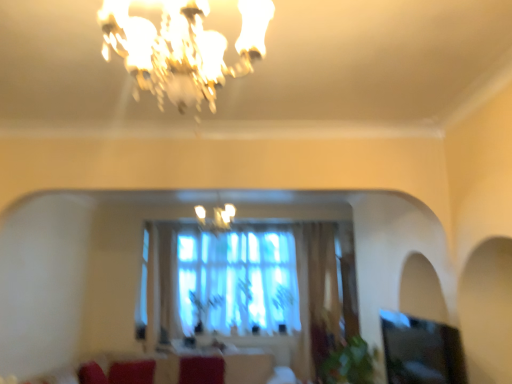
Find the location of a particular element. The image size is (512, 384). gold crystal chandelier at upper center, which ranks as the first lamp in front-to-back order is located at coordinates (182, 48).

Find the location of `wooden round table at center`. wooden round table at center is located at coordinates (211, 347).

Locate an element on the screen. This screenshot has height=384, width=512. velvet red couch at lower center is located at coordinates (178, 370).

Measure the distance between point (182, 359) and camera.

Point (182, 359) is 5.80 meters away from camera.

This screenshot has width=512, height=384. In order to click on gold crystal chandelier at upper center, which is the 1th lamp from top to bottom in this screenshot , I will do `click(182, 48)`.

Is transparent glass window screen at lower right touching gold crystal chandelier at upper center, which ranks as the first lamp in front-to-back order?

transparent glass window screen at lower right and gold crystal chandelier at upper center, which ranks as the first lamp in front-to-back order, are clearly separated.

Is transparent glass window screen at lower right in front of or behind gold crystal chandelier at upper center, which appears as the second lamp when ordered from the bottom, in the image?

Clearly, transparent glass window screen at lower right is behind gold crystal chandelier at upper center, which appears as the second lamp when ordered from the bottom.

Is transparent glass window screen at lower right facing towards gold crystal chandelier at upper center, marked as the second lamp in a back-to-front arrangement?

No.

Measure the distance from transparent glass window screen at lower right to gold crystal chandelier at upper center, marked as the second lamp in a back-to-front arrangement.

A distance of 5.65 feet exists between transparent glass window screen at lower right and gold crystal chandelier at upper center, marked as the second lamp in a back-to-front arrangement.

In the scene shown: From their relative heights in the image, would you say gold crystal chandelier at upper center, which is the 1th lamp from top to bottom, is taller or shorter than velvet red couch at lower center?

gold crystal chandelier at upper center, which is the 1th lamp from top to bottom, is taller than velvet red couch at lower center.

Is the surface of gold crystal chandelier at upper center, marked as the second lamp in a back-to-front arrangement, in direct contact with velvet red couch at lower center?

No, gold crystal chandelier at upper center, marked as the second lamp in a back-to-front arrangement, is not making contact with velvet red couch at lower center.

Does point (174, 25) lie behind point (137, 369)?

No, (174, 25) is closer to viewer.

Considering the points (194, 207) and (228, 348), which point is behind, point (194, 207) or point (228, 348)?

The point (228, 348) is more distant.

Where is `round table below the matte glass chandelier at center, the 1th lamp in the bottom-to-top sequence (from the image's perspective)`? The image size is (512, 384). round table below the matte glass chandelier at center, the 1th lamp in the bottom-to-top sequence (from the image's perspective) is located at coordinates (211, 347).

How far apart are matte glass chandelier at center, arranged as the second lamp when viewed from the top, and wooden round table at center?

matte glass chandelier at center, arranged as the second lamp when viewed from the top, is 2.23 meters from wooden round table at center.

What's the angular difference between matte glass chandelier at center, positioned as the first lamp in back-to-front order, and wooden round table at center's facing directions?

The facing directions of matte glass chandelier at center, positioned as the first lamp in back-to-front order, and wooden round table at center are 0.899 degrees apart.

Is wooden round table at center touching velvet red couch at lower center?

No, wooden round table at center is not touching velvet red couch at lower center.

Is wooden round table at center positioned with its back to velvet red couch at lower center?

No.

Which of these two, wooden round table at center or velvet red couch at lower center, is smaller?

wooden round table at center.

Which object is further away from the camera, wooden round table at center or velvet red couch at lower center?

wooden round table at center.

From the image's perspective, is transparent glass window screen at lower right located above velvet red couch at lower center?

Yes.

Would you say transparent glass window screen at lower right is a long distance from velvet red couch at lower center?

Yes, transparent glass window screen at lower right is far from velvet red couch at lower center.

Would you say transparent glass window screen at lower right contains velvet red couch at lower center?

No, velvet red couch at lower center is not inside transparent glass window screen at lower right.

Is transparent glass window screen at lower right bigger than velvet red couch at lower center?

No.

Consider the image. Is velvet maroon swivel chair at center surrounding matte glass chandelier at center, which appears as the 2th lamp when viewed from the front?

No, matte glass chandelier at center, which appears as the 2th lamp when viewed from the front, is not inside velvet maroon swivel chair at center.

Considering the sizes of velvet maroon swivel chair at center and matte glass chandelier at center, which appears as the 2th lamp when viewed from the front, in the image, is velvet maroon swivel chair at center bigger or smaller than matte glass chandelier at center, which appears as the 2th lamp when viewed from the front,?

In the image, velvet maroon swivel chair at center appears to be smaller than matte glass chandelier at center, which appears as the 2th lamp when viewed from the front.

At what (x,y) coordinates should I click in order to perform the action: click on lamp that is the 1st object to the right of the velvet maroon swivel chair at center, starting at the anchor. Please return your answer as a coordinate pair (x, y). Image resolution: width=512 pixels, height=384 pixels. Looking at the image, I should click on (216, 218).

Looking at the image, does velvet maroon swivel chair at center seem bigger or smaller compared to velvet red couch at lower center?

Considering their sizes, velvet maroon swivel chair at center takes up less space than velvet red couch at lower center.

Can velvet red couch at lower center be found inside velvet maroon swivel chair at center?

No, velvet red couch at lower center is not a part of velvet maroon swivel chair at center.

Considering the relative sizes of velvet maroon swivel chair at center and velvet red couch at lower center in the image provided, is velvet maroon swivel chair at center taller than velvet red couch at lower center?

Incorrect, the height of velvet maroon swivel chair at center is not larger of that of velvet red couch at lower center.

From the image's perspective, starting from the transparent glass window screen at lower right, which lamp is the 2nd one above? Please provide its 2D coordinates.

[(182, 48)]

The height and width of the screenshot is (384, 512). In order to click on couch located behind the gold crystal chandelier at upper center, which ranks as the first lamp in front-to-back order in this screenshot , I will do `click(178, 370)`.

Considering their positions, is velvet red couch at lower center positioned closer to gold crystal chandelier at upper center, which ranks as the first lamp in front-to-back order, than wooden round table at center?

velvet red couch at lower center is closer to gold crystal chandelier at upper center, which ranks as the first lamp in front-to-back order.

Based on their spatial positions, is velvet red couch at lower center or transparent glass window screen at lower right further from matte glass chandelier at center, the 1th lamp in the bottom-to-top sequence?

transparent glass window screen at lower right lies further to matte glass chandelier at center, the 1th lamp in the bottom-to-top sequence, than the other object.

Which object lies further to the anchor point velvet maroon swivel chair at center, velvet red couch at lower center or wooden round table at center?

wooden round table at center lies further to velvet maroon swivel chair at center than the other object.

Estimate the real-world distances between objects in this image. Which object is closer to matte glass chandelier at center, the 1th lamp in the bottom-to-top sequence, gold crystal chandelier at upper center, which is the 1th lamp from top to bottom, or velvet maroon swivel chair at center?

velvet maroon swivel chair at center is positioned closer to the anchor matte glass chandelier at center, the 1th lamp in the bottom-to-top sequence.

Based on their spatial positions, is velvet red couch at lower center or gold crystal chandelier at upper center, marked as the second lamp in a back-to-front arrangement, closer to velvet maroon swivel chair at center?

velvet red couch at lower center.

Based on their spatial positions, is velvet red couch at lower center or matte glass chandelier at center, positioned as the first lamp in back-to-front order, further from transparent glass window screen at lower right?

Based on the image, velvet red couch at lower center appears to be further to transparent glass window screen at lower right.

Based on their spatial positions, is wooden round table at center or gold crystal chandelier at upper center, which is the 1th lamp from top to bottom, further from transparent glass window screen at lower right?

wooden round table at center lies further to transparent glass window screen at lower right than the other object.

When comparing their distances from transparent glass window screen at lower right, does wooden round table at center or velvet red couch at lower center seem further?

wooden round table at center is positioned further to the anchor transparent glass window screen at lower right.

Identify the location of window screen positioned between gold crystal chandelier at upper center, marked as the second lamp in a back-to-front arrangement, and matte glass chandelier at center, which appears as the 2th lamp when viewed from the front, from near to far. (421, 351).

Identify the location of couch between transparent glass window screen at lower right and wooden round table at center from front to back. This screenshot has width=512, height=384. (178, 370).

Find the location of `lamp located between transparent glass window screen at lower right and velvet maroon swivel chair at center in the depth direction`. lamp located between transparent glass window screen at lower right and velvet maroon swivel chair at center in the depth direction is located at coordinates (216, 218).

What are the coordinates of `lamp between transparent glass window screen at lower right and velvet red couch at lower center in the front-back direction` in the screenshot? It's located at (216, 218).